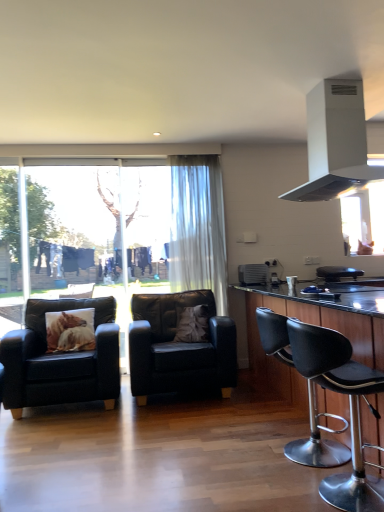
The image size is (384, 512). What do you see at coordinates (350, 409) in the screenshot?
I see `black leather stool at lower right, the 1th chair from the front` at bounding box center [350, 409].

Image resolution: width=384 pixels, height=512 pixels. In order to click on black leather cabinet at right in this screenshot , I will do `click(317, 325)`.

What do you see at coordinates (253, 274) in the screenshot? I see `satin silver air conditioner at center` at bounding box center [253, 274].

Find the location of a particular element. This screenshot has width=384, height=512. brown fabric pillow at center, arranged as the 2th pillow when viewed from the left is located at coordinates (193, 325).

Describe the element at coordinates (193, 325) in the screenshot. This screenshot has height=512, width=384. I see `brown fabric pillow at center, the 1th pillow from the right` at that location.

Locate an element on the screen. This screenshot has height=512, width=384. black leather stool at lower right, which appears as the 3th chair when viewed from the left is located at coordinates (350, 409).

Is satin silver air conditioner at center far from brown fabric pillow at center, arranged as the 2th pillow when viewed from the left?

Actually, satin silver air conditioner at center and brown fabric pillow at center, arranged as the 2th pillow when viewed from the left, are a little close together.

What's the angular difference between satin silver air conditioner at center and brown fabric pillow at center, the 1th pillow from the right,'s facing directions?

satin silver air conditioner at center and brown fabric pillow at center, the 1th pillow from the right, are facing 140 degrees away from each other.

Does satin silver air conditioner at center have a smaller size compared to brown fabric pillow at center, the 1th pillow from the right?

Yes, satin silver air conditioner at center is smaller than brown fabric pillow at center, the 1th pillow from the right.

Measure the distance between satin silver air conditioner at center and brown fabric pillow at center, arranged as the 2th pillow when viewed from the left.

satin silver air conditioner at center and brown fabric pillow at center, arranged as the 2th pillow when viewed from the left, are 28.37 inches apart from each other.

Could you measure the distance between printed fabric pillow at left, the 1th pillow in the left-to-right sequence, and white matte range hood at upper right?

The distance of printed fabric pillow at left, the 1th pillow in the left-to-right sequence, from white matte range hood at upper right is 2.40 meters.

Identify the location of kitchen appliance above the printed fabric pillow at left, the 2th pillow viewed from the right (from a real-world perspective). The image size is (384, 512). (335, 142).

Is printed fabric pillow at left, the 2th pillow viewed from the right, positioned beyond the bounds of white matte range hood at upper right?

Yes, printed fabric pillow at left, the 2th pillow viewed from the right, is located beyond the bounds of white matte range hood at upper right.

Is black leather chair at center, which is the second chair in back-to-front order, wider or thinner than sheer white curtain at center?

black leather chair at center, which is the second chair in back-to-front order, is wider than sheer white curtain at center.

Choose the correct answer: Is black leather chair at center, which is the second chair in back-to-front order, inside sheer white curtain at center or outside it?

black leather chair at center, which is the second chair in back-to-front order, is located beyond the bounds of sheer white curtain at center.

Is black leather chair at center, which is the second chair in back-to-front order, looking in the opposite direction of sheer white curtain at center?

No, black leather chair at center, which is the second chair in back-to-front order, is not facing away from sheer white curtain at center.

Does black leather stool at lower right, acting as the 2th chair starting from the right, lie behind black leather cabinet at right?

Yes, black leather stool at lower right, acting as the 2th chair starting from the right, is behind black leather cabinet at right.

Considering the relative sizes of black leather stool at lower right, the 1th chair from the front, and black leather cabinet at right in the image provided, is black leather stool at lower right, the 1th chair from the front, thinner than black leather cabinet at right?

Yes.

From a real-world perspective, is black leather stool at lower right, acting as the 2th chair starting from the right, physically below black leather cabinet at right?

Correct, in the physical world, black leather stool at lower right, acting as the 2th chair starting from the right, is lower than black leather cabinet at right.

Which of these two, black leather stool at lower right, the 1th chair from the front, or black leather cabinet at right, stands shorter?

black leather stool at lower right, the 1th chair from the front, is shorter.

Does point (357, 385) lie behind point (215, 390)?

No, (357, 385) is closer to viewer.

From a real-world perspective, is black leather stool at lower right, the 4th chair from the back, located beneath black leather chair at center, the 3th chair positioned from the front?

Correct, in the physical world, black leather stool at lower right, the 4th chair from the back, is lower than black leather chair at center, the 3th chair positioned from the front.

How far apart are black leather stool at lower right, which appears as the 3th chair when viewed from the left, and black leather chair at center, which is the second chair in back-to-front order?

A distance of 4.60 feet exists between black leather stool at lower right, which appears as the 3th chair when viewed from the left, and black leather chair at center, which is the second chair in back-to-front order.

Looking at this image, is black leather stool at lower right, which appears as the 3th chair when viewed from the left, looking in the opposite direction of black leather chair at center, which ranks as the 3th chair in right-to-left order?

That's not correct — black leather stool at lower right, which appears as the 3th chair when viewed from the left, is not looking away from black leather chair at center, which ranks as the 3th chair in right-to-left order.

Does black leather chair at center, which ranks as the 3th chair in right-to-left order, appear on the left side of black leather stool at lower right, which appears as the 3th chair when viewed from the left?

Yes.

Could you tell me if black leather chair at center, which is the second chair in back-to-front order, is turned towards black leather stool at lower right, the 1th chair from the front?

Yes, black leather chair at center, which is the second chair in back-to-front order, is facing black leather stool at lower right, the 1th chair from the front.

Considering the sizes of objects black leather chair at center, the 2th chair positioned from the left, and black leather stool at lower right, the 1th chair from the front, in the image provided, who is thinner, black leather chair at center, the 2th chair positioned from the left, or black leather stool at lower right, the 1th chair from the front,?

Thinner between the two is black leather stool at lower right, the 1th chair from the front.

Is matte black armchair at left, acting as the third chair starting from the back, outside of black leather stool at lower right, the 1th chair from the front?

Yes, matte black armchair at left, acting as the third chair starting from the back, is not within black leather stool at lower right, the 1th chair from the front.

Consider the image. Does matte black armchair at left, marked as the 1th chair in a left-to-right arrangement, have a smaller size compared to black leather stool at lower right, which appears as the 3th chair when viewed from the left?

No, matte black armchair at left, marked as the 1th chair in a left-to-right arrangement, is not smaller than black leather stool at lower right, which appears as the 3th chair when viewed from the left.

From the image's perspective, which is above, matte black armchair at left, marked as the 1th chair in a left-to-right arrangement, or black leather stool at lower right, which appears as the 3th chair when viewed from the left?

black leather stool at lower right, which appears as the 3th chair when viewed from the left.

Would you say matte black armchair at left, the 4th chair from the right, is to the left or to the right of black leather stool at lower right, the 4th chair from the back, in the picture?

Based on their positions, matte black armchair at left, the 4th chair from the right, is located to the left of black leather stool at lower right, the 4th chair from the back.

Locate an element on the screen. Image resolution: width=384 pixels, height=512 pixels. appliance above the brown fabric pillow at center, the 1th pillow from the right (from the image's perspective) is located at coordinates (253, 274).

You are a GUI agent. You are given a task and a screenshot of the screen. Output one action in this format:
    pyautogui.click(x=<x>, y=<y>)
    Task: Click on the kitchen appliance in front of the printed fabric pillow at left, the 2th pillow viewed from the right
    
    Given the screenshot: What is the action you would take?
    pyautogui.click(x=335, y=142)

Based on their spatial positions, is white matte range hood at upper right or brown fabric pillow at center, arranged as the 2th pillow when viewed from the left, further from black leather chair at center, the 3th chair positioned from the front?

white matte range hood at upper right is positioned further to the anchor black leather chair at center, the 3th chair positioned from the front.

Which object lies nearer to the anchor point black leather chair at center, which is the first chair in right-to-left order, black leather chair at center, the 3th chair positioned from the front, or black leather cabinet at right?

black leather cabinet at right lies closer to black leather chair at center, which is the first chair in right-to-left order, than the other object.

Based on their spatial positions, is black leather stool at lower right, acting as the 2th chair starting from the right, or black leather chair at center, the 4th chair when ordered from left to right, further from sheer white curtain at center?

black leather stool at lower right, acting as the 2th chair starting from the right, is further to sheer white curtain at center.

When comparing their distances from sheer white curtain at center, does matte black armchair at left, marked as the 1th chair in a left-to-right arrangement, or satin silver air conditioner at center seem closer?

satin silver air conditioner at center lies closer to sheer white curtain at center than the other object.

Which object lies nearer to the anchor point printed fabric pillow at left, the 2th pillow viewed from the right, black leather chair at center, which is the first chair in right-to-left order, or matte black armchair at left, marked as the 1th chair in a left-to-right arrangement?

matte black armchair at left, marked as the 1th chair in a left-to-right arrangement.

Looking at this image, which object lies further to the anchor point black leather cabinet at right, black leather chair at center, the 3th chair positioned from the front, or matte black armchair at left, acting as the third chair starting from the back?

matte black armchair at left, acting as the third chair starting from the back, is positioned further to the anchor black leather cabinet at right.

Looking at the image, which one is located closer to satin silver air conditioner at center, black leather stool at lower right, the 1th chair from the front, or printed fabric pillow at left, the 1th pillow in the left-to-right sequence?

printed fabric pillow at left, the 1th pillow in the left-to-right sequence.

Consider the image. Looking at the image, which one is located closer to matte black armchair at left, marked as the 1th chair in a left-to-right arrangement, black leather chair at center, marked as the fourth chair in a front-to-back arrangement, or satin silver air conditioner at center?

Among the two, satin silver air conditioner at center is located nearer to matte black armchair at left, marked as the 1th chair in a left-to-right arrangement.

This screenshot has height=512, width=384. What are the coordinates of `curtain between printed fabric pillow at left, the 1th pillow in the left-to-right sequence, and satin silver air conditioner at center` in the screenshot? It's located at (198, 228).

At what (x,y) coordinates should I click in order to perform the action: click on pillow between matte black armchair at left, acting as the third chair starting from the back, and black leather cabinet at right. Please return your answer as a coordinate pair (x, y). Image resolution: width=384 pixels, height=512 pixels. Looking at the image, I should click on (193, 325).

Where is `pillow located between printed fabric pillow at left, the 1th pillow in the left-to-right sequence, and sheer white curtain at center in the left-right direction`? This screenshot has width=384, height=512. pillow located between printed fabric pillow at left, the 1th pillow in the left-to-right sequence, and sheer white curtain at center in the left-right direction is located at coordinates (193, 325).

This screenshot has height=512, width=384. What are the coordinates of `appliance located between matte black armchair at left, acting as the third chair starting from the back, and black leather chair at center, marked as the fourth chair in a front-to-back arrangement, in the left-right direction` in the screenshot? It's located at click(x=253, y=274).